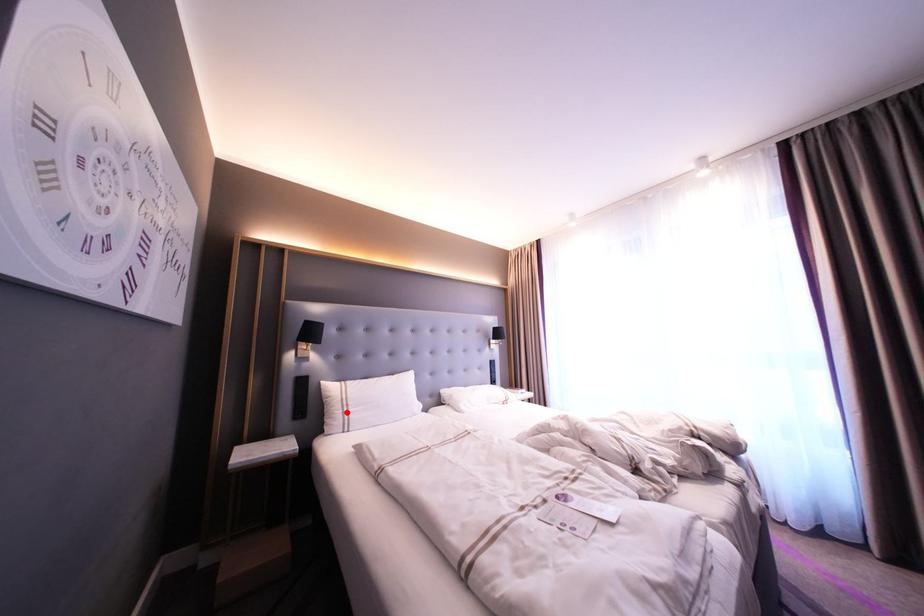
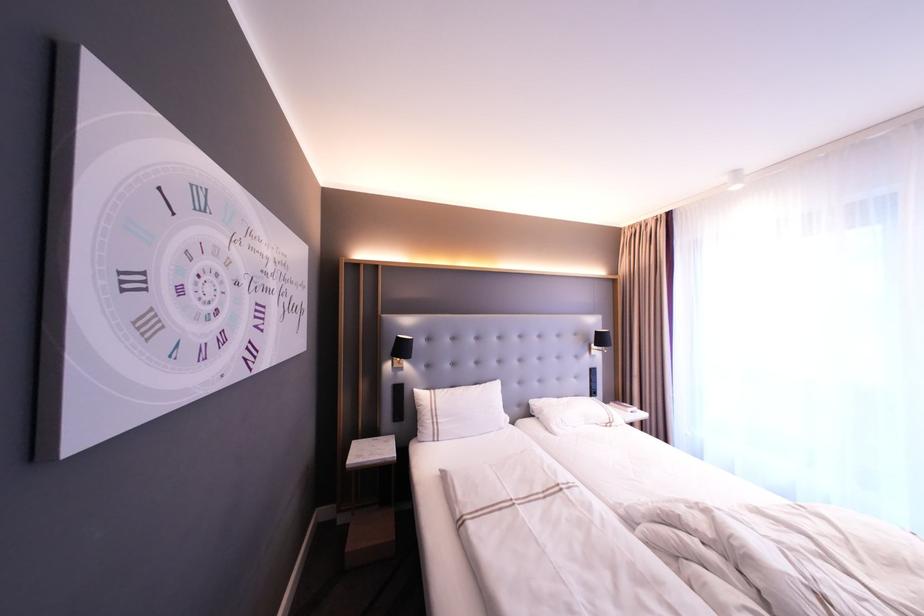
The point at the highlighted location is marked in the first image. Where is the corresponding point in the second image?

(435, 422)